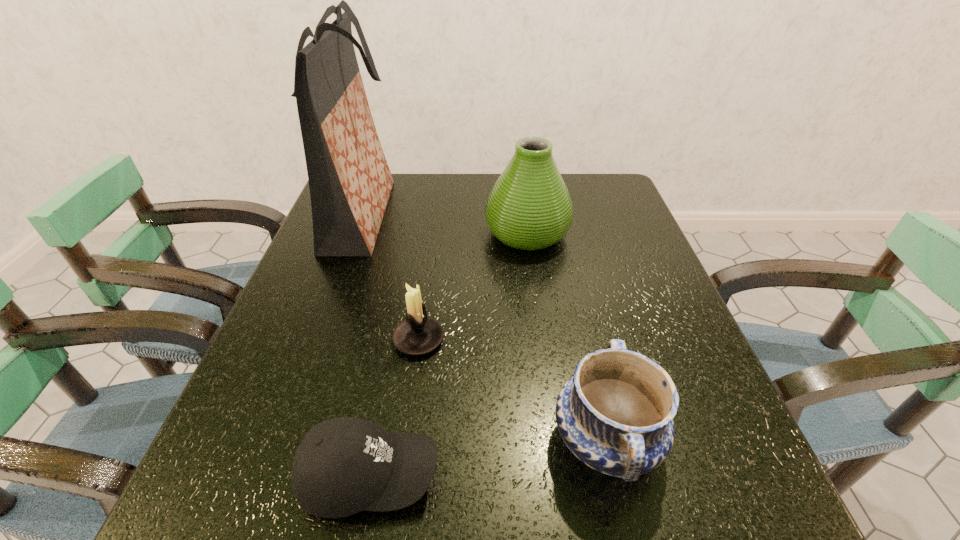
The height and width of the screenshot is (540, 960). I want to click on shopping bag, so [x=350, y=182].

Identify the location of the second tallest object. The height and width of the screenshot is (540, 960). (529, 207).

This screenshot has height=540, width=960. Identify the location of the third nearest object. (417, 335).

At what (x,y) coordinates should I click in order to perform the action: click on pottery. Please return your answer as a coordinate pair (x, y). The height and width of the screenshot is (540, 960). Looking at the image, I should click on (615, 414).

This screenshot has width=960, height=540. What are the coordinates of `the shortest object` in the screenshot? It's located at (344, 465).

The height and width of the screenshot is (540, 960). Find the location of `vacant space situated 0.340m on the front-facing side of the shopping bag`. vacant space situated 0.340m on the front-facing side of the shopping bag is located at coordinates (525, 215).

Where is `vacant space located on the left of the fourth shortest object`? This screenshot has width=960, height=540. vacant space located on the left of the fourth shortest object is located at coordinates (449, 233).

Where is `free region located 0.190m on the back of the third nearest object`? This screenshot has height=540, width=960. free region located 0.190m on the back of the third nearest object is located at coordinates (429, 262).

At what (x,y) coordinates should I click in order to perform the action: click on vacant space located 0.380m on the left of the pottery. Please return your answer as a coordinate pair (x, y). Looking at the image, I should click on (313, 440).

Identify the location of vacant area situated 0.220m on the front-facing side of the baseball cap. (587, 476).